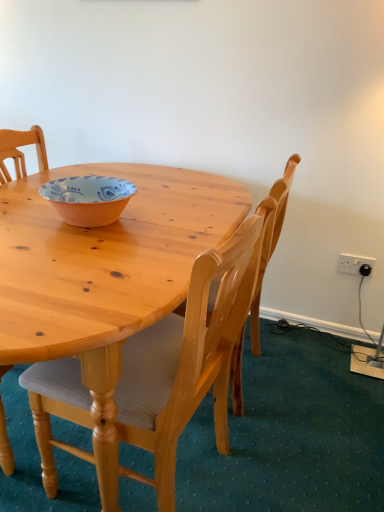
Question: From their relative heights in the image, would you say white plastic power outlet at upper right is taller or shorter than light wood chair at center, the first chair positioned from the front?

Choices:
 (A) tall
 (B) short

Answer: (B)

Question: Considering their positions, is white plastic power outlet at upper right located in front of or behind light wood chair at center, the first chair positioned from the front?

Choices:
 (A) behind
 (B) front

Answer: (A)

Question: Considering the real-world distances, which object is farthest from the white plastic power outlet at upper right?

Choices:
 (A) light wood chair at center, the first chair positioned from the front
 (B) light brown wood chair at center, which is the second chair in front-to-back order
 (C) orange glazed bowl at center

Answer: (C)

Question: Estimate the real-world distances between objects in this image. Which object is farther from the white plastic power outlet at upper right?

Choices:
 (A) light wood chair at center, the first chair positioned from the front
 (B) light brown wood chair at center, arranged as the first chair when viewed from the back
 (C) orange glazed bowl at center

Answer: (C)